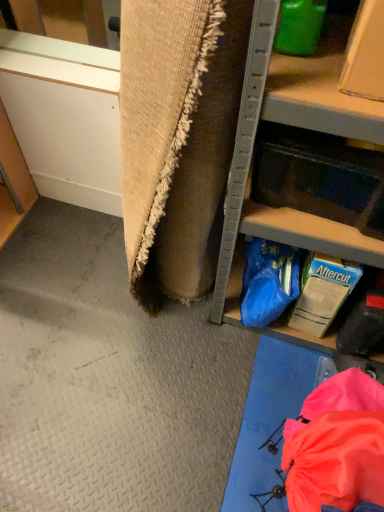
I want to click on metallic gray shelf at right, so click(296, 158).

Describe the element at coordinates (296, 158) in the screenshot. The height and width of the screenshot is (512, 384). I see `metallic gray shelf at right` at that location.

Measure the distance between point (263, 128) and camera.

A distance of 33.31 inches exists between point (263, 128) and camera.

Measure the distance between point (289, 146) and camera.

The depth of point (289, 146) is 32.36 inches.

At what (x,y) coordinates should I click in order to perform the action: click on translucent plastic drawer at lower right. Please return your answer as a coordinate pair (x, y). The image size is (384, 512). Looking at the image, I should click on coord(322,181).

This screenshot has width=384, height=512. Describe the element at coordinates (322, 181) in the screenshot. I see `translucent plastic drawer at lower right` at that location.

The image size is (384, 512). I want to click on metallic gray shelf at right, so click(296, 158).

Would you say translucent plastic drawer at lower right is to the left or to the right of metallic gray shelf at right in the picture?

From the image, it's evident that translucent plastic drawer at lower right is to the left of metallic gray shelf at right.

Considering the relative positions of translucent plastic drawer at lower right and metallic gray shelf at right in the image provided, is translucent plastic drawer at lower right in front of metallic gray shelf at right?

No, translucent plastic drawer at lower right is further to the viewer.

Considering the points (377, 226) and (280, 325), which point is behind, point (377, 226) or point (280, 325)?

The point (280, 325) is farther from the camera.

From the image's perspective, who appears lower, translucent plastic drawer at lower right or metallic gray shelf at right?

translucent plastic drawer at lower right, from the image's perspective.

From a real-world perspective, is translucent plastic drawer at lower right physically below metallic gray shelf at right?

Actually, translucent plastic drawer at lower right is physically above metallic gray shelf at right in the real world.

Does translucent plastic drawer at lower right have a lesser width compared to metallic gray shelf at right?

Yes, translucent plastic drawer at lower right is thinner than metallic gray shelf at right.

Is translucent plastic drawer at lower right shorter than metallic gray shelf at right?

Indeed, translucent plastic drawer at lower right has a lesser height compared to metallic gray shelf at right.

Which of these two, translucent plastic drawer at lower right or metallic gray shelf at right, is smaller?

translucent plastic drawer at lower right is smaller.

Does translucent plastic drawer at lower right contain metallic gray shelf at right?

No, metallic gray shelf at right is not surrounded by translucent plastic drawer at lower right.

Are translucent plastic drawer at lower right and metallic gray shelf at right making contact?

Yes, translucent plastic drawer at lower right is beside metallic gray shelf at right.

Is translucent plastic drawer at lower right facing towards metallic gray shelf at right?

Yes, translucent plastic drawer at lower right is facing metallic gray shelf at right.

What's the angular difference between translucent plastic drawer at lower right and metallic gray shelf at right's facing directions?

The facing directions of translucent plastic drawer at lower right and metallic gray shelf at right are 4.61 degrees apart.

What are the coordinates of `shelf located above the translucent plastic drawer at lower right (from the image's perspective)` in the screenshot? It's located at (296, 158).

Considering the relative positions of metallic gray shelf at right and translucent plastic drawer at lower right in the image provided, is metallic gray shelf at right to the right of translucent plastic drawer at lower right from the viewer's perspective?

Correct, you'll find metallic gray shelf at right to the right of translucent plastic drawer at lower right.

Is metallic gray shelf at right behind translucent plastic drawer at lower right?

No, metallic gray shelf at right is in front of translucent plastic drawer at lower right.

Which is in front, point (307, 71) or point (255, 176)?

The point (307, 71) is closer.

From the image's perspective, is metallic gray shelf at right on translucent plastic drawer at lower right?

Indeed, from the image's perspective, metallic gray shelf at right is shown above translucent plastic drawer at lower right.

In the scene shown: From a real-world perspective, is metallic gray shelf at right below translucent plastic drawer at lower right?

Indeed, from a real-world perspective, metallic gray shelf at right is positioned beneath translucent plastic drawer at lower right.

Does metallic gray shelf at right have a lesser width compared to translucent plastic drawer at lower right?

No, metallic gray shelf at right is not thinner than translucent plastic drawer at lower right.

Is metallic gray shelf at right taller or shorter than translucent plastic drawer at lower right?

In the image, metallic gray shelf at right appears to be taller than translucent plastic drawer at lower right.

Can you confirm if metallic gray shelf at right is smaller than translucent plastic drawer at lower right?

Actually, metallic gray shelf at right might be larger than translucent plastic drawer at lower right.

Is translucent plastic drawer at lower right located within metallic gray shelf at right?

Yes, translucent plastic drawer at lower right is inside metallic gray shelf at right.

Is the surface of metallic gray shelf at right in direct contact with translucent plastic drawer at lower right?

Yes, metallic gray shelf at right and translucent plastic drawer at lower right clearly make contact.

Is translucent plastic drawer at lower right at the back of metallic gray shelf at right?

Yes, metallic gray shelf at right is facing away from translucent plastic drawer at lower right.

How far apart are metallic gray shelf at right and translucent plastic drawer at lower right?

metallic gray shelf at right is 2.99 inches away from translucent plastic drawer at lower right.

You are a GUI agent. You are given a task and a screenshot of the screen. Output one action in this format:
    pyautogui.click(x=<x>, y=<y>)
    Task: Click on the shelf below the translucent plastic drawer at lower right (from a real-world perspective)
    
    Given the screenshot: What is the action you would take?
    pyautogui.click(x=296, y=158)

Identify the location of shelf on the right of translucent plastic drawer at lower right. (296, 158).

Identify the location of drawer that is below the metallic gray shelf at right (from the image's perspective). (322, 181).